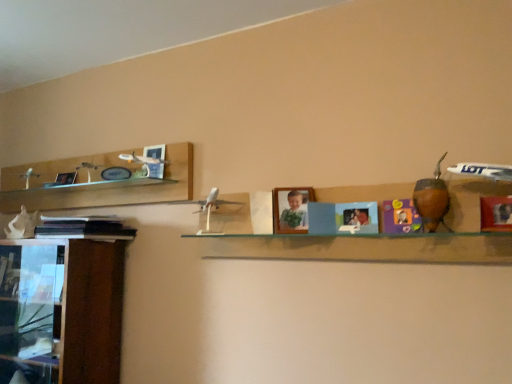
Question: Does matte purple toy at center, the 2th toy positioned from the left, have a larger size compared to brown leather gourd at right, the third toy viewed from the back?

Choices:
 (A) no
 (B) yes

Answer: (A)

Question: Is matte purple toy at center, the 2th toy viewed from the right, at the left side of brown leather gourd at right, marked as the 3th toy in a left-to-right arrangement?

Choices:
 (A) yes
 (B) no

Answer: (A)

Question: Is matte purple toy at center, the 2th toy viewed from the right, behind brown leather gourd at right, placed as the first toy when sorted from front to back?

Choices:
 (A) no
 (B) yes

Answer: (B)

Question: Is matte purple toy at center, which is the second toy in back-to-front order, thinner than brown leather gourd at right, the third toy viewed from the back?

Choices:
 (A) yes
 (B) no

Answer: (A)

Question: Is matte purple toy at center, the 2th toy positioned from the left, in contact with brown leather gourd at right, the first toy when ordered from right to left?

Choices:
 (A) no
 (B) yes

Answer: (B)

Question: Would you say clear glass shelf at center is inside or outside matte purple toy at center, the 2th toy viewed from the right?

Choices:
 (A) outside
 (B) inside

Answer: (A)

Question: From the image's perspective, relative to matte purple toy at center, the 2th toy viewed from the right, is clear glass shelf at center above or below?

Choices:
 (A) above
 (B) below

Answer: (B)

Question: Considering the positions of clear glass shelf at center and matte purple toy at center, which appears as the 2th toy when viewed from the front, in the image, is clear glass shelf at center wider or thinner than matte purple toy at center, which appears as the 2th toy when viewed from the front,?

Choices:
 (A) thin
 (B) wide

Answer: (B)

Question: Considering their positions, is clear glass shelf at center located in front of or behind matte purple toy at center, the 2th toy positioned from the left?

Choices:
 (A) front
 (B) behind

Answer: (A)

Question: Based on their sizes in the image, would you say wooden cabinet at left is bigger or smaller than clear glass shelf at center?

Choices:
 (A) small
 (B) big

Answer: (B)

Question: From the image's perspective, is wooden cabinet at left above or below clear glass shelf at center?

Choices:
 (A) above
 (B) below

Answer: (B)

Question: Looking at their shapes, would you say wooden cabinet at left is wider or thinner than clear glass shelf at center?

Choices:
 (A) wide
 (B) thin

Answer: (A)

Question: In terms of height, does wooden cabinet at left look taller or shorter compared to clear glass shelf at center?

Choices:
 (A) short
 (B) tall

Answer: (B)

Question: Based on their positions, is matte purple toy at center, which appears as the 2th toy when viewed from the front, located to the left or right of black matte book at left?

Choices:
 (A) left
 (B) right

Answer: (B)

Question: Is point (403, 208) positioned closer to the camera than point (126, 228)?

Choices:
 (A) closer
 (B) farther

Answer: (A)